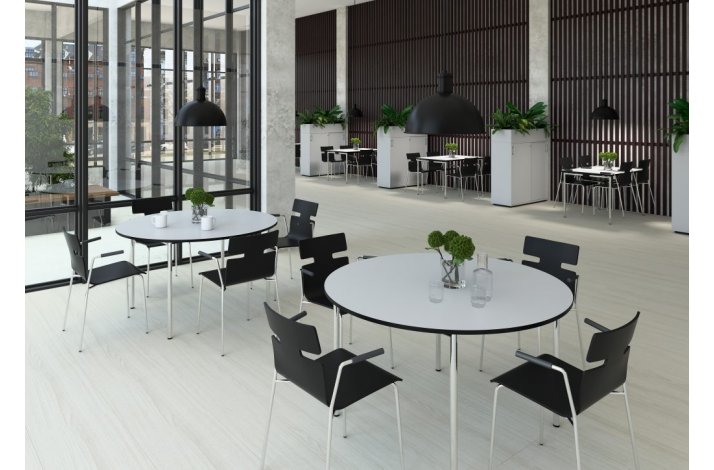
Find the location of a particular element. This screenshot has width=714, height=470. cups is located at coordinates (158, 218), (205, 221), (433, 289), (478, 295).